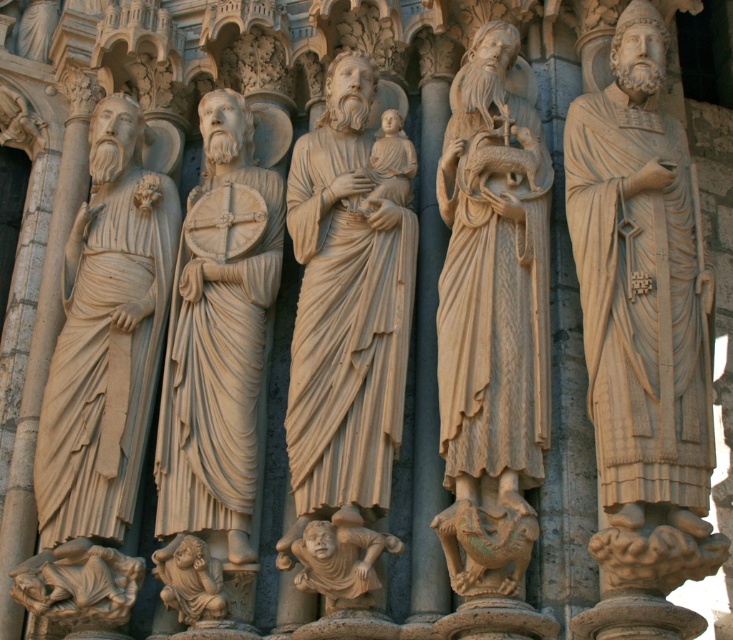
Is beige stone statue of man holding fish at center above beige stone cherub at lower center?

Yes, beige stone statue of man holding fish at center is above beige stone cherub at lower center.

Does beige stone statue of man holding fish at center appear on the left side of beige stone cherub at lower center?

Incorrect, beige stone statue of man holding fish at center is not on the left side of beige stone cherub at lower center.

In order to click on beige stone statue of man holding fish at center in this screenshot , I will do tap(493, 310).

You are a GUI agent. You are given a task and a screenshot of the screen. Output one action in this format:
    pyautogui.click(x=<x>, y=<y>)
    Task: Click on the beige stone statue of man holding fish at center
    The image size is (733, 640).
    Given the screenshot: What is the action you would take?
    pyautogui.click(x=493, y=310)

Is point (464, 412) positioned before point (243, 257)?

Yes, point (464, 412) is in front of point (243, 257).

Locate an element on the screen. This screenshot has height=640, width=733. beige stone statue of man holding fish at center is located at coordinates (493, 310).

Between point (507, 582) and point (194, 516), which one is positioned behind?

Point (194, 516)

The image size is (733, 640). I want to click on beige stone statue of man holding fish at center, so click(x=493, y=310).

Is beige stone statue at center taller than beige stone cherub at center?

Indeed, beige stone statue at center has a greater height compared to beige stone cherub at center.

Who is more forward, (265, 188) or (302, 544)?

Point (302, 544) is in front.

You are a GUI agent. You are given a task and a screenshot of the screen. Output one action in this format:
    pyautogui.click(x=<x>, y=<y>)
    Task: Click on the beige stone statue at center
    
    Given the screenshot: What is the action you would take?
    pyautogui.click(x=217, y=348)